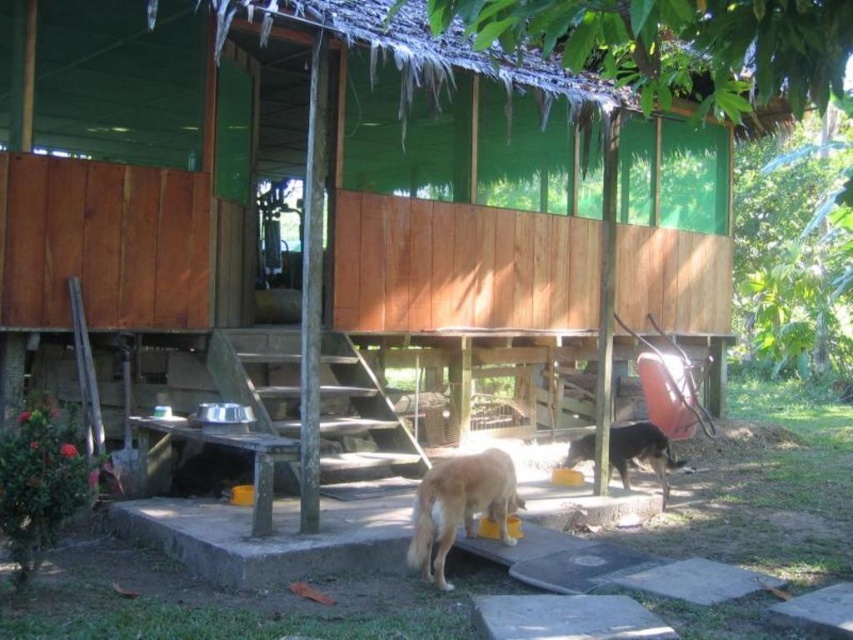
This screenshot has height=640, width=853. What do you see at coordinates (459, 506) in the screenshot?
I see `golden fur dog at lower center` at bounding box center [459, 506].

In the scene shown: Which is more to the right, golden fur dog at lower center or brown fur dog at lower center?

Positioned to the right is brown fur dog at lower center.

Between point (473, 518) and point (572, 451), which one is positioned behind?

The point (572, 451) is behind.

Identify the location of golden fur dog at lower center. (459, 506).